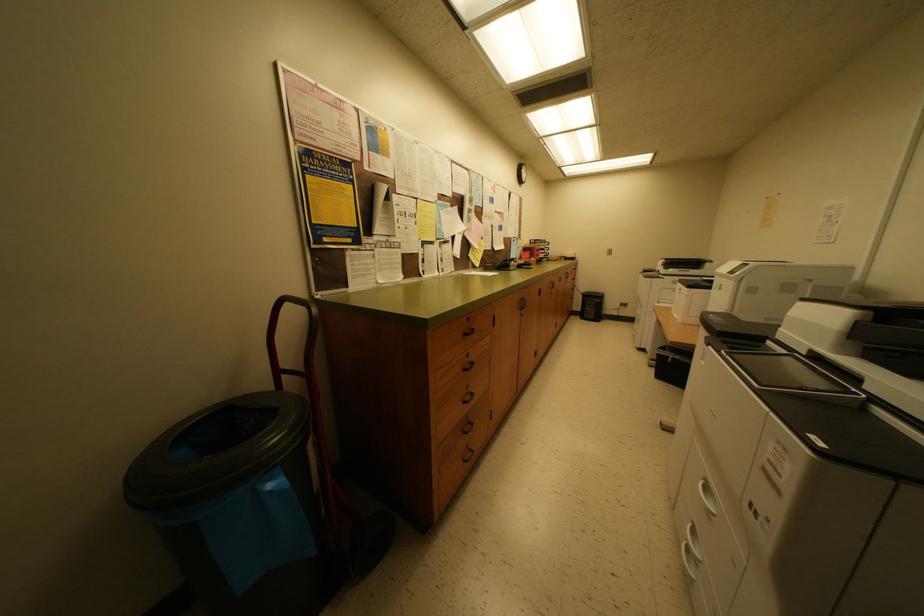
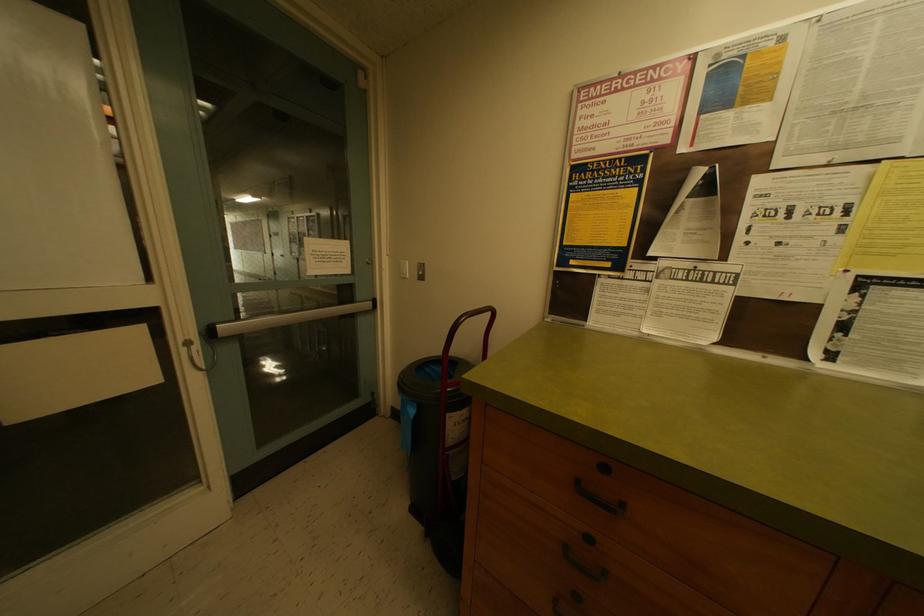
Question: The camera is either moving clockwise (left) or counter-clockwise (right) around the object. The first image is from the beginning of the video and the second image is from the end. Is the camera moving left or right when shooting the video?

Choices:
 (A) Left
 (B) Right

Answer: (B)